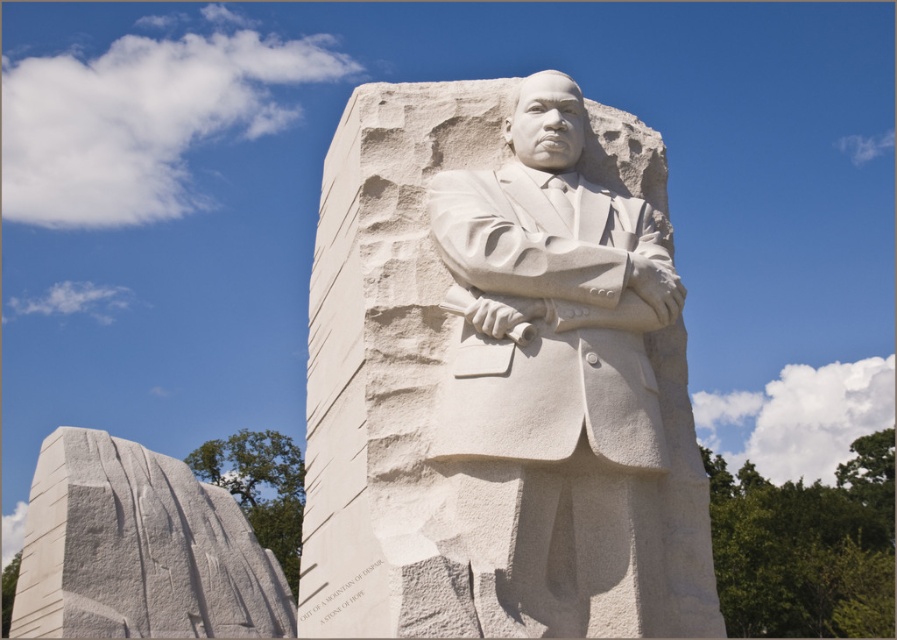
Does white marble statue at center appear on the left side of white marble stone at left?

Incorrect, white marble statue at center is not on the left side of white marble stone at left.

Between white marble statue at center and white marble stone at left, which one is positioned higher?

white marble statue at center is higher up.

Is point (545, 241) behind point (103, 540)?

No, (545, 241) is in front of (103, 540).

Locate an element on the screen. Image resolution: width=897 pixels, height=640 pixels. white marble statue at center is located at coordinates (560, 381).